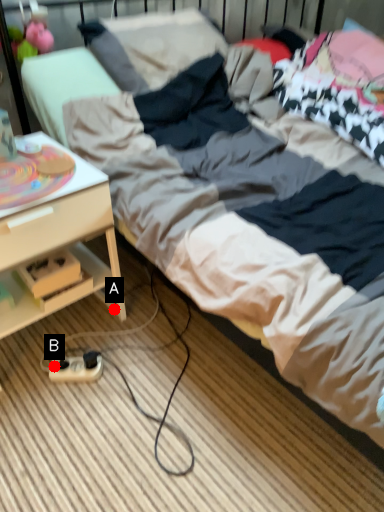
Question: Two points are circled on the image, labeled by A and B beside each circle. Which point is farther from the camera taking this photo?

Choices:
 (A) A is further
 (B) B is further

Answer: (A)